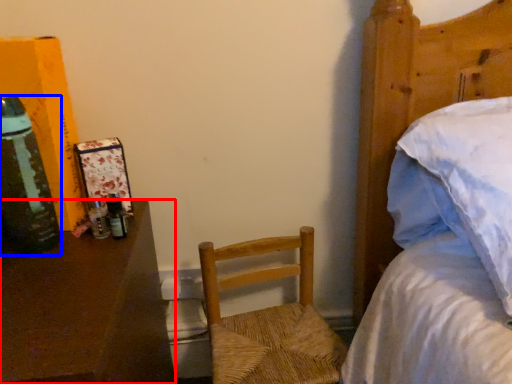
Question: Among these objects, which one is farthest to the camera, desk (highlighted by a red box) or bottle (highlighted by a blue box)?

Choices:
 (A) desk
 (B) bottle

Answer: (B)